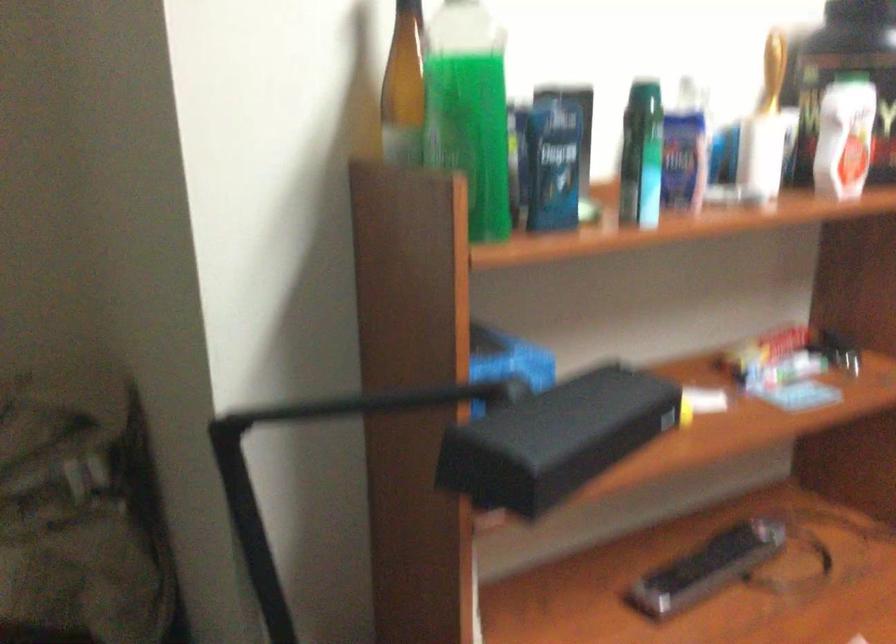
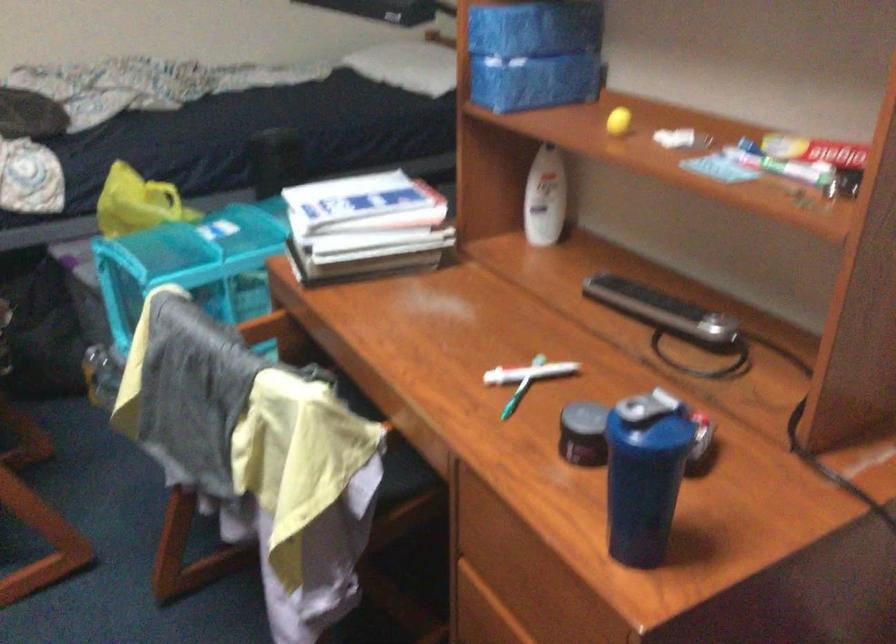
Find the pixel in the second image that matches (519,357) in the first image.

(536, 26)